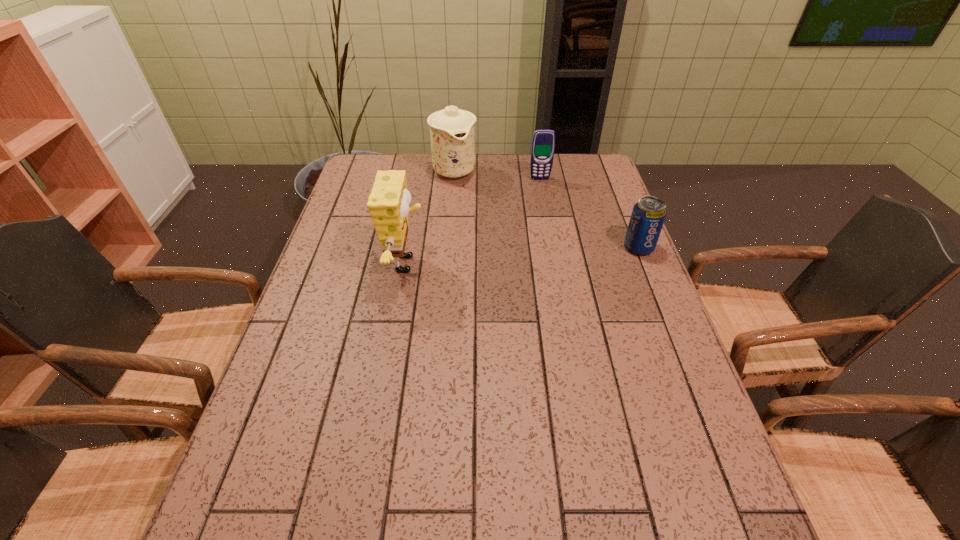
Locate an element on the screen. vacant space at the near left corner is located at coordinates (233, 476).

At what (x,y) coordinates should I click in order to perform the action: click on free space at the far right corner of the desktop. Please return your answer as a coordinate pair (x, y). The width and height of the screenshot is (960, 540). Looking at the image, I should click on (566, 157).

The width and height of the screenshot is (960, 540). I want to click on vacant space that is in between the third object from left to right and the chinaware, so click(x=497, y=174).

At what (x,y) coordinates should I click in order to perform the action: click on free space between the sponge and the chinaware. Please return your answer as a coordinate pair (x, y). The height and width of the screenshot is (540, 960). Looking at the image, I should click on (431, 217).

The width and height of the screenshot is (960, 540). Find the location of `empty space that is in between the sponge and the chinaware`. empty space that is in between the sponge and the chinaware is located at coordinates (431, 217).

The image size is (960, 540). I want to click on vacant space that's between the soda and the cellular telephone, so click(x=589, y=213).

The width and height of the screenshot is (960, 540). I want to click on free space between the chinaware and the shortest object, so click(546, 208).

At what (x,y) coordinates should I click in order to perform the action: click on free space between the chinaware and the cellular telephone. Please return your answer as a coordinate pair (x, y). Looking at the image, I should click on (497, 174).

You are a GUI agent. You are given a task and a screenshot of the screen. Output one action in this format:
    pyautogui.click(x=<x>, y=<y>)
    Task: Click on the vacant space in between the soda and the cellular telephone
    The height and width of the screenshot is (540, 960).
    Given the screenshot: What is the action you would take?
    pyautogui.click(x=589, y=213)

Locate an element on the screen. The height and width of the screenshot is (540, 960). blank region between the sponge and the cellular telephone is located at coordinates (473, 221).